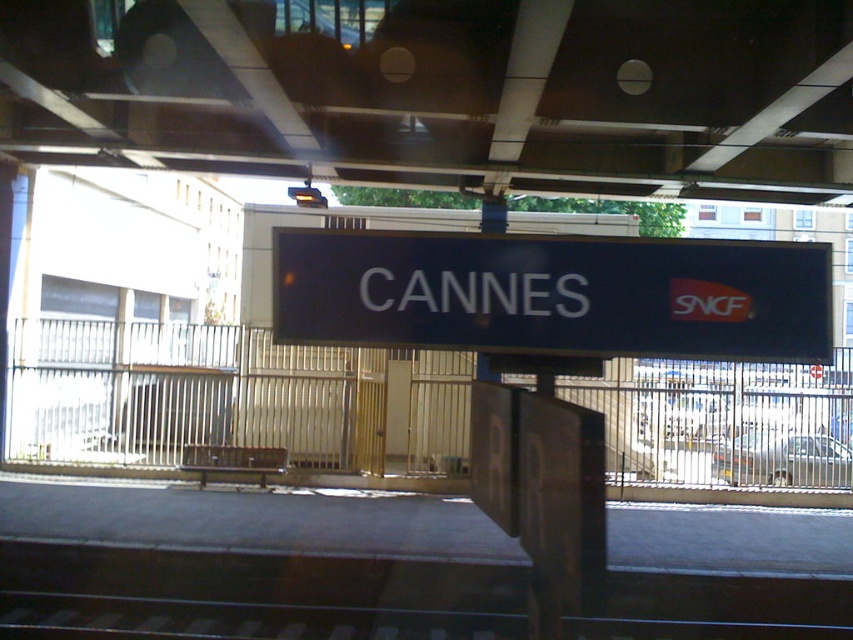
Does metal at center appear on the left side of black matte sign at center?

Yes, metal at center is to the left of black matte sign at center.

Who is higher up, metal at center or black matte sign at center?

metal at center is above.

This screenshot has height=640, width=853. What are the coordinates of `metal at center` in the screenshot? It's located at (444, 92).